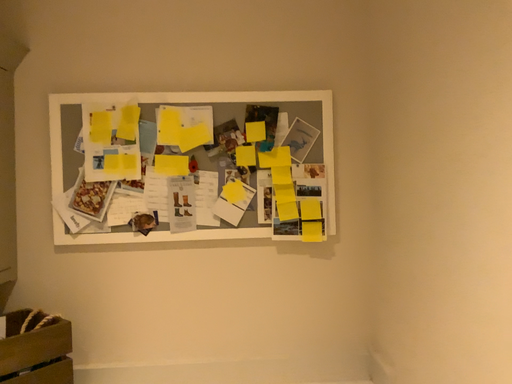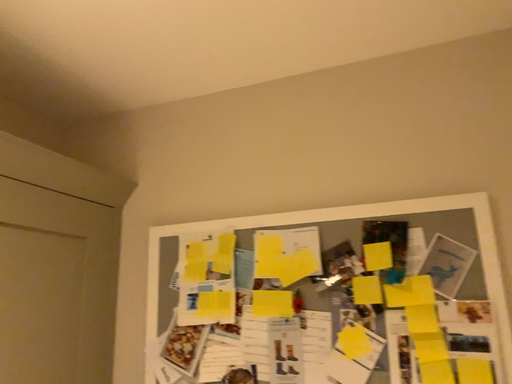
Question: How did the camera likely rotate when shooting the video?

Choices:
 (A) rotated upward
 (B) rotated downward

Answer: (A)